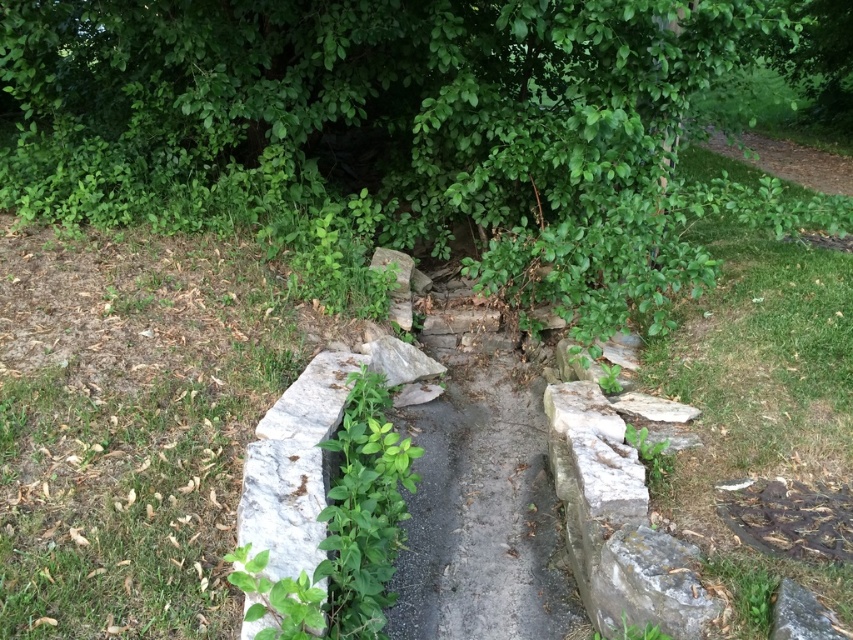
Is green leafy tree at upper center smaller than green leafy weed at center?

Incorrect, green leafy tree at upper center is not smaller in size than green leafy weed at center.

Locate an element on the screen. Image resolution: width=853 pixels, height=640 pixels. green leafy tree at upper center is located at coordinates (399, 129).

Between green leafy tree at upper center and gray stone path at center, which one has more height?

green leafy tree at upper center is taller.

This screenshot has width=853, height=640. What do you see at coordinates (399, 129) in the screenshot?
I see `green leafy tree at upper center` at bounding box center [399, 129].

Does point (621, 145) lie behind point (451, 499)?

Yes, point (621, 145) is farther from viewer.

I want to click on green leafy tree at upper center, so click(399, 129).

From the picture: Is gray stone path at center below green leafy weed at center?

Indeed, gray stone path at center is positioned under green leafy weed at center.

Between point (537, 444) and point (268, 570), which one is positioned behind?

The point (537, 444) is behind.

I want to click on gray stone path at center, so click(x=482, y=513).